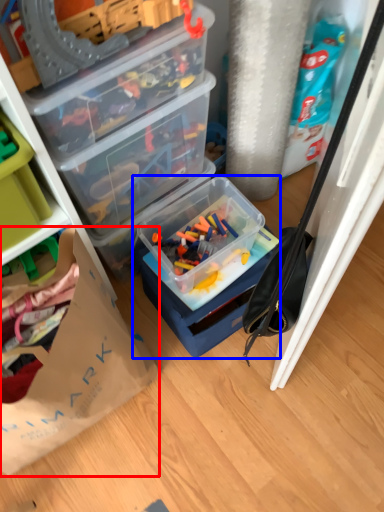
Question: Among these objects, which one is farthest to the camera, paper bag (highlighted by a red box) or box (highlighted by a blue box)?

Choices:
 (A) paper bag
 (B) box

Answer: (B)